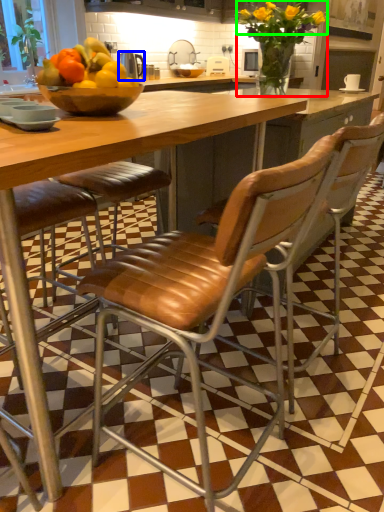
Question: Estimate the real-world distances between objects in this image. Which object is farther from flower (highlighted by a red box), appliance (highlighted by a blue box) or flower (highlighted by a green box)?

Choices:
 (A) appliance
 (B) flower

Answer: (A)